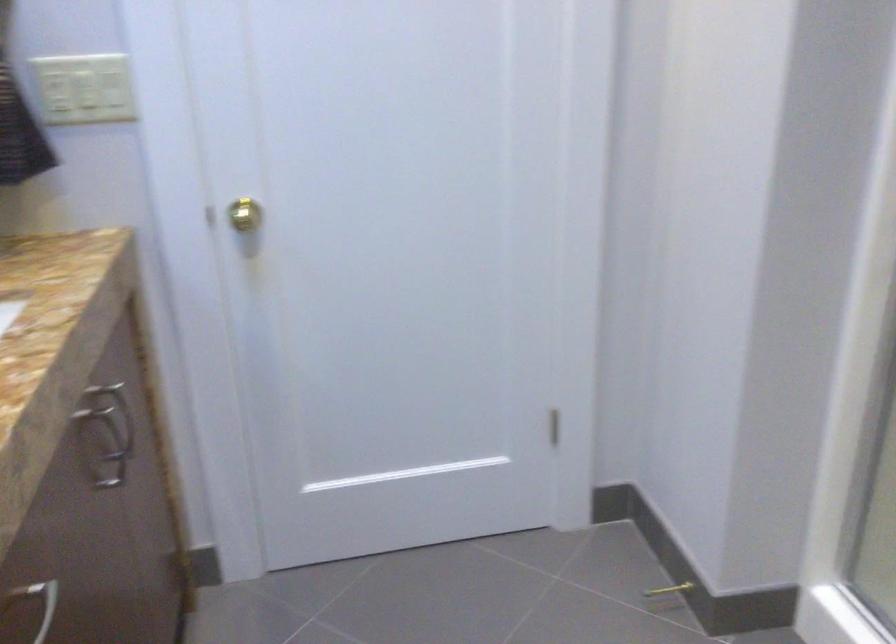
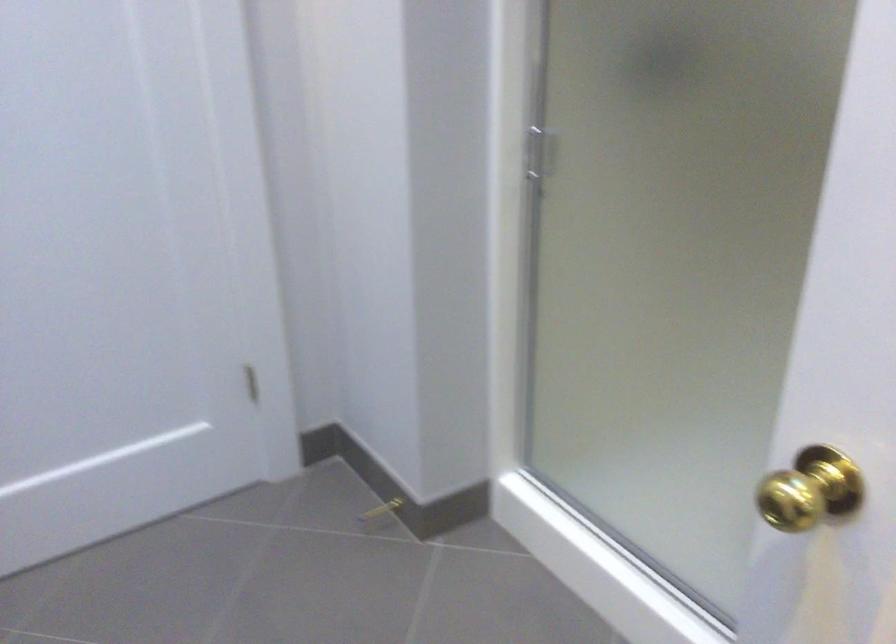
Question: How did the camera likely rotate?

Choices:
 (A) Left
 (B) Right
 (C) Up
 (D) Down

Answer: (B)